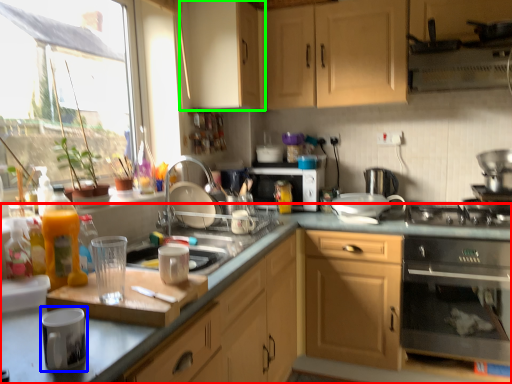
Question: Which is nearer to the cabinetry (highlighted by a red box)? appliance (highlighted by a blue box) or cabinetry (highlighted by a green box).

Choices:
 (A) appliance
 (B) cabinetry

Answer: (A)